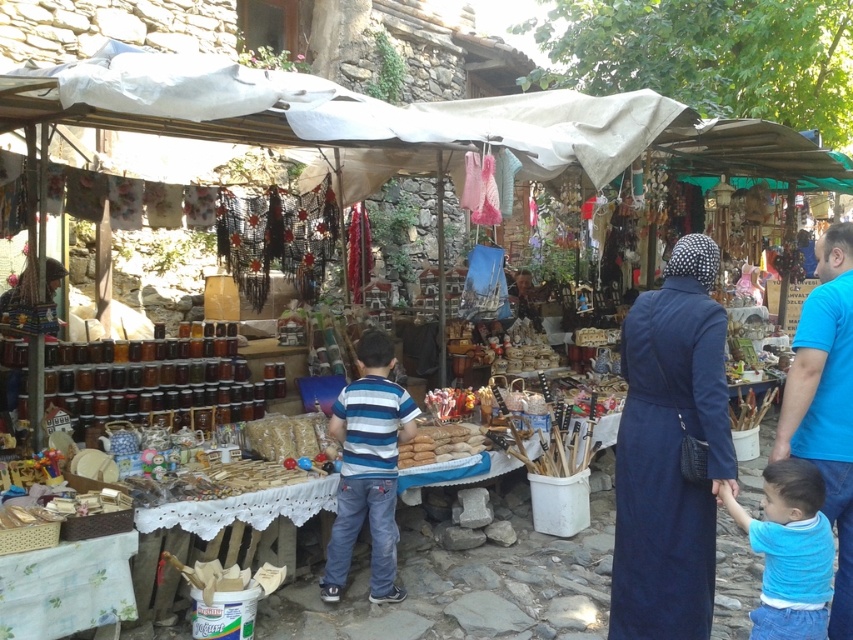
Question: Which point is closer to the camera taking this photo?

Choices:
 (A) (372, 339)
 (B) (740, 518)
 (C) (834, 502)

Answer: (B)

Question: Which point appears farthest from the camera in this image?

Choices:
 (A) (398, 451)
 (B) (822, 372)
 (C) (712, 518)

Answer: (A)

Question: In this image, where is blue cotton shirt at lower right located relative to brown matte bread at center?

Choices:
 (A) below
 (B) above

Answer: (A)

Question: Which object is closer to the camera taking this photo?

Choices:
 (A) striped cotton shirt at center
 (B) navy blue fabric dress at center
 (C) blue cotton shirt at right

Answer: (B)

Question: Can you confirm if navy blue fabric dress at center is positioned to the right of blue cotton shirt at right?

Choices:
 (A) yes
 (B) no

Answer: (B)

Question: Does navy blue fabric dress at center have a greater width compared to striped cotton shirt at center?

Choices:
 (A) no
 (B) yes

Answer: (A)